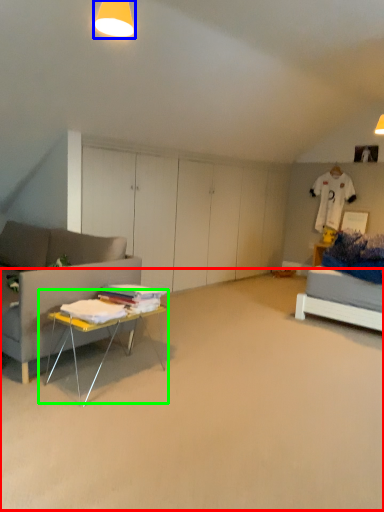
Question: Which is farther away from plain (highlighted by a red box)? lighting (highlighted by a blue box) or table (highlighted by a green box)?

Choices:
 (A) lighting
 (B) table

Answer: (A)